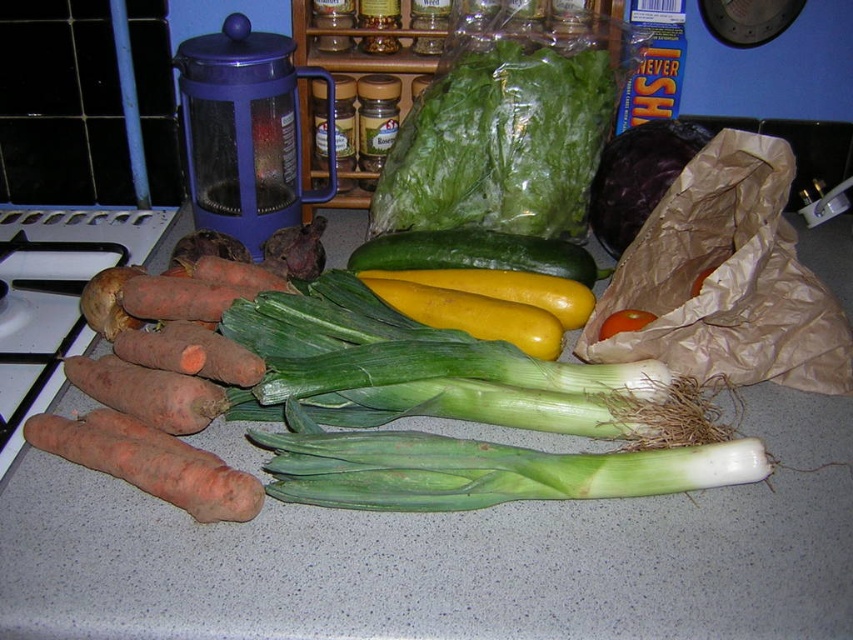
Does point (258, 499) come closer to viewer compared to point (606, 332)?

That is True.

Can you confirm if orange matte carrot at lower left is smaller than red matte tomato at center?

No.

Where is `orange matte carrot at lower left`? The height and width of the screenshot is (640, 853). orange matte carrot at lower left is located at coordinates (149, 461).

You are a GUI agent. You are given a task and a screenshot of the screen. Output one action in this format:
    pyautogui.click(x=<x>, y=<y>)
    Task: Click on the orange matte carrot at lower left
    
    Given the screenshot: What is the action you would take?
    pyautogui.click(x=149, y=461)

Between point (86, 448) and point (115, 294), which one is positioned in front?

Positioned in front is point (86, 448).

Is orange matte carrot at lower left thinner than orange matte carrot at left?

In fact, orange matte carrot at lower left might be wider than orange matte carrot at left.

Who is more forward, (138, 456) or (128, 328)?

Point (138, 456)

Find the location of a particular element. The image size is (853, 640). orange matte carrot at lower left is located at coordinates (149, 461).

Does smooth gray countertop at center appear on the right side of green leafy lettuce at center?

No, smooth gray countertop at center is not to the right of green leafy lettuce at center.

Between point (96, 582) and point (566, 177), which one is positioned in front?

Point (96, 582) is more forward.

The height and width of the screenshot is (640, 853). I want to click on smooth gray countertop at center, so click(447, 557).